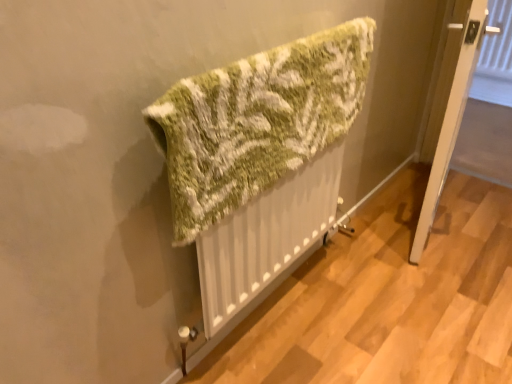
Question: From the image's perspective, is green knitted towel at center on white wooden door at lower right?

Choices:
 (A) no
 (B) yes

Answer: (A)

Question: Is green knitted towel at center in contact with white wooden door at lower right?

Choices:
 (A) yes
 (B) no

Answer: (B)

Question: Is green knitted towel at center at the right side of white wooden door at lower right?

Choices:
 (A) yes
 (B) no

Answer: (B)

Question: From the image's perspective, is green knitted towel at center located beneath white wooden door at lower right?

Choices:
 (A) no
 (B) yes

Answer: (B)

Question: Could you tell me if green knitted towel at center is turned towards white wooden door at lower right?

Choices:
 (A) yes
 (B) no

Answer: (B)

Question: Is white wooden door at lower right located within green knitted towel at center?

Choices:
 (A) yes
 (B) no

Answer: (B)

Question: Does white wooden door at lower right have a greater height compared to green knitted towel at center?

Choices:
 (A) no
 (B) yes

Answer: (B)

Question: Is white wooden door at lower right oriented away from green knitted towel at center?

Choices:
 (A) yes
 (B) no

Answer: (B)

Question: Can you confirm if white wooden door at lower right is positioned to the right of green knitted towel at center?

Choices:
 (A) yes
 (B) no

Answer: (A)

Question: Considering the relative positions of white wooden door at lower right and green knitted towel at center in the image provided, is white wooden door at lower right to the left of green knitted towel at center from the viewer's perspective?

Choices:
 (A) yes
 (B) no

Answer: (B)

Question: Is white wooden door at lower right aimed at green knitted towel at center?

Choices:
 (A) no
 (B) yes

Answer: (A)

Question: Is white wooden door at lower right completely or partially outside of green knitted towel at center?

Choices:
 (A) no
 (B) yes

Answer: (B)

Question: In terms of width, does green knitted towel at center look wider or thinner when compared to white wooden door at lower right?

Choices:
 (A) thin
 (B) wide

Answer: (A)